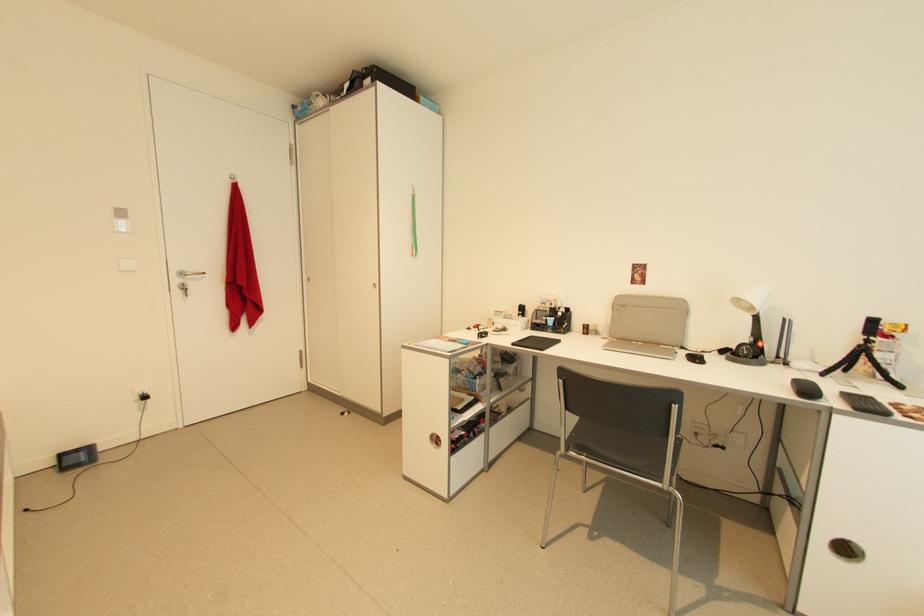
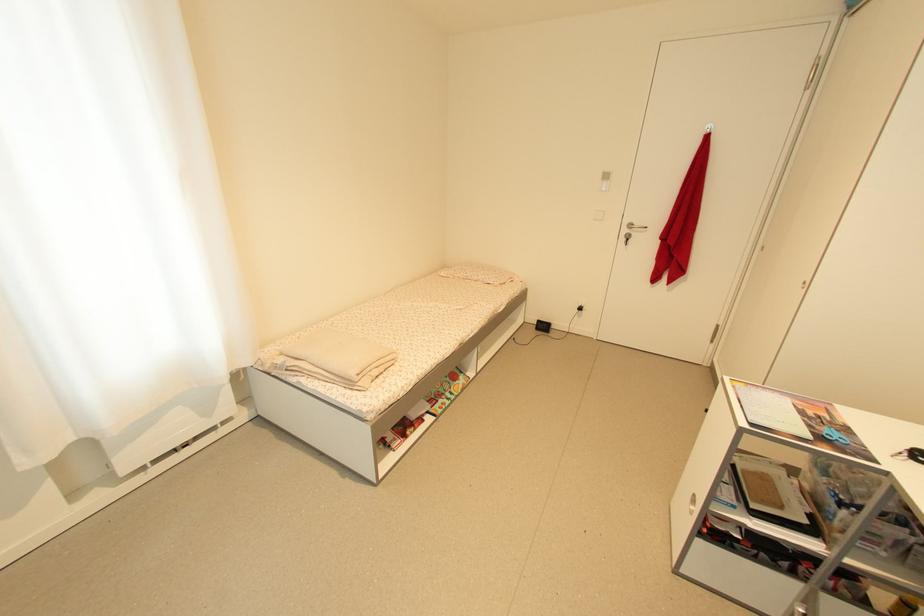
Based on the continuous images, in which direction is the camera rotating?

The rotation direction of the camera is left-down.